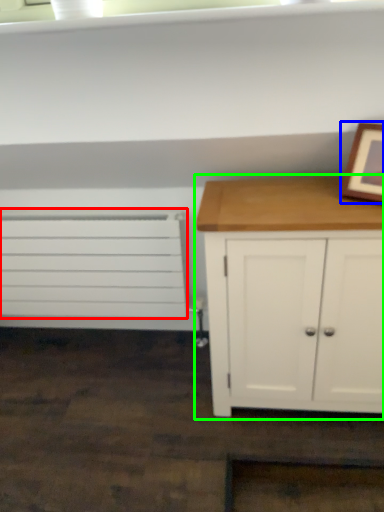
Question: Which object is the farthest from drawer (highlighted by a red box)? Choose among these: picture frame (highlighted by a blue box) or chest of drawers (highlighted by a green box).

Choices:
 (A) picture frame
 (B) chest of drawers

Answer: (A)